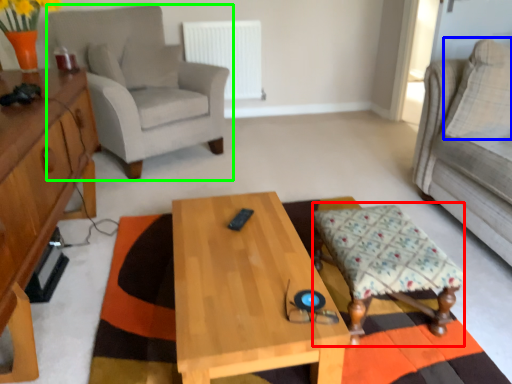
Question: Which is farther away from stool (highlighted by a red box)? pillow (highlighted by a blue box) or chair (highlighted by a green box)?

Choices:
 (A) pillow
 (B) chair

Answer: (B)